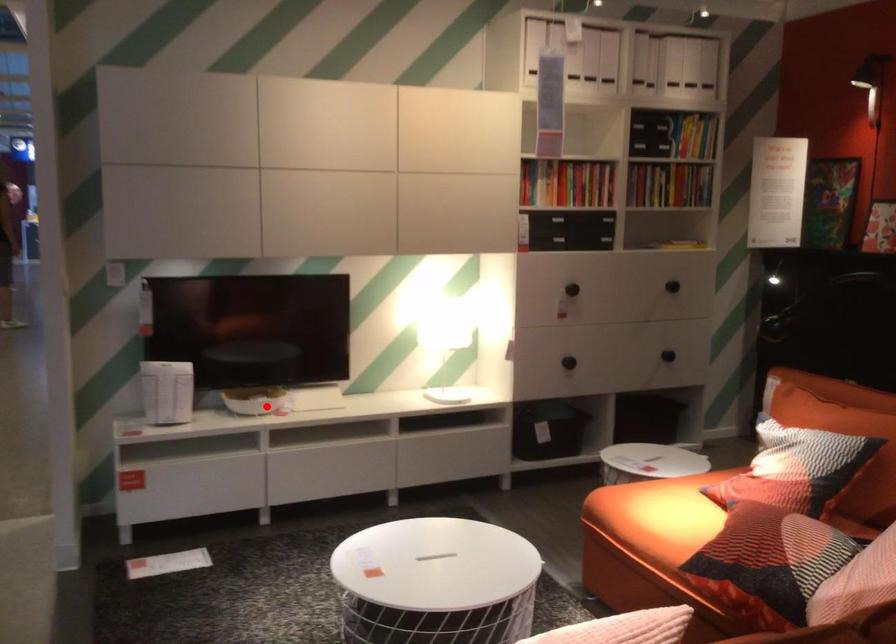
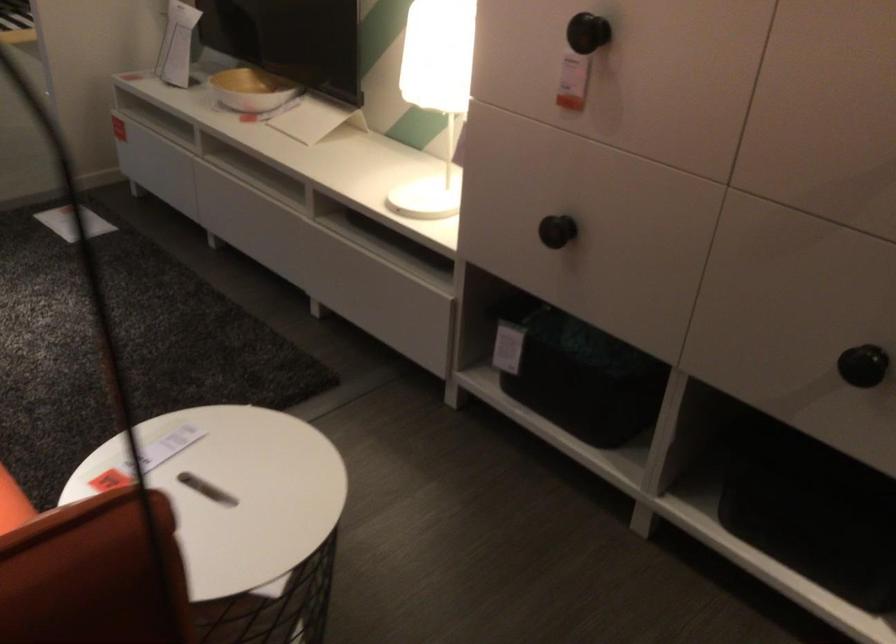
Question: I am providing you with two images of the same scene from different viewpoints. A red point is marked on the first image. At the location where the point appears in image 1, is it still visible in image 2?

Choices:
 (A) Yes
 (B) No

Answer: (A)